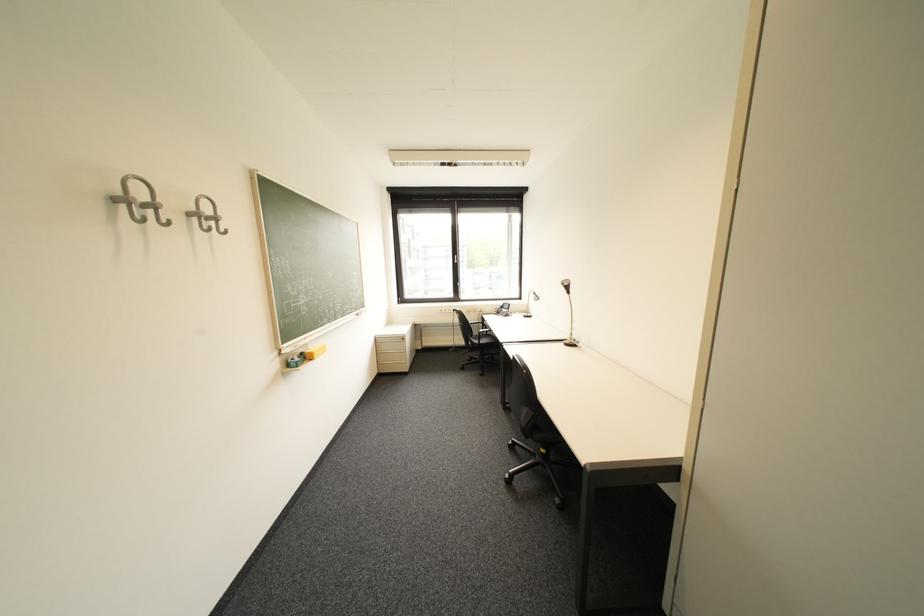
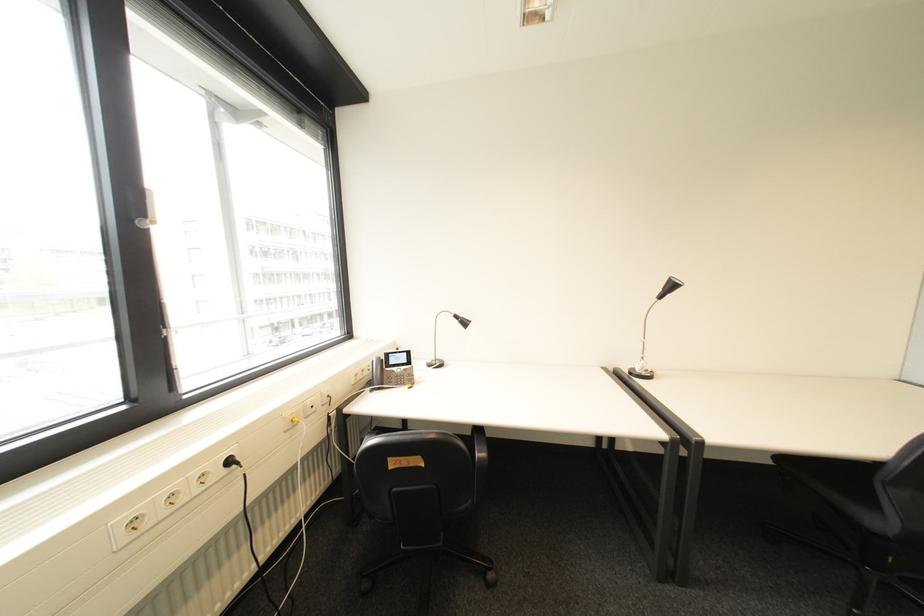
Locate, in the second image, the point that corresponds to pixel 465 310 in the first image.

(239, 463)